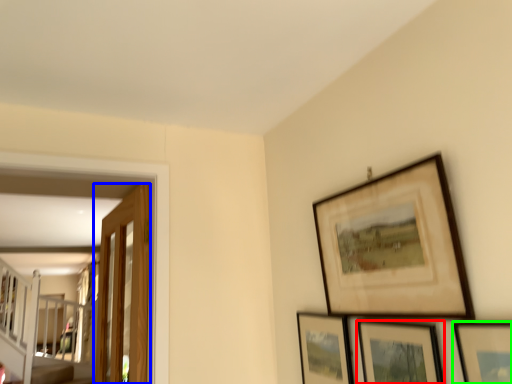
Question: Considering the real-world distances, which object is farthest from picture frame (highlighted by a red box)? door (highlighted by a blue box) or picture frame (highlighted by a green box)?

Choices:
 (A) door
 (B) picture frame

Answer: (A)